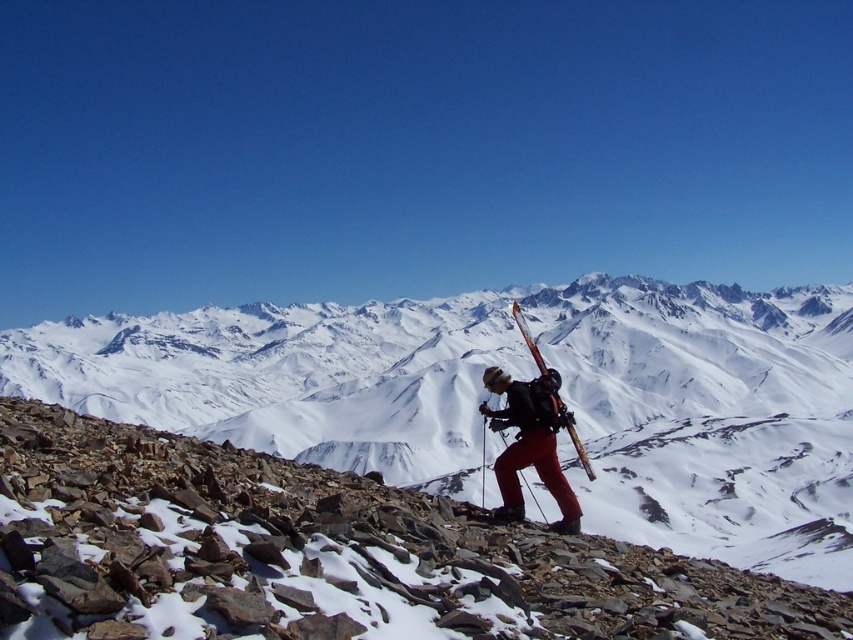
You are standing at the camera position and want to reach the point marked at coordinates (228, 433). Given that your average walking speed is 3 miles per hour, how long would it take you to reach that point?

The point at coordinates (228, 433) is 505.01 feet away. Converting this distance to miles, 505.01 feet is approximately 0.0956 miles. At a walking speed of 3 mph, the time required would be distance divided by speed, so 0.0956 miles divided by 3 mph equals approximately 0.0319 hours. Converting hours to minutes by multiplying by 60 gives roughly 1.91 minutes, so about 2 minutes.

You are a mountain guide planning a route for your group. You notice the point marked at coordinates (517, 378) in the image. What significant feature is located at that point?

The point at coordinates (517, 378) marks the location of the snowy rocky mountain at center.

You are a mountain guide assessing the safety of the path for a group. You notice the snowy rocky mountain at center and the matte black ski at center. Which object takes up more space in the image?

The snowy rocky mountain at center is bigger than the matte black ski at center, so it takes up more space in the image.